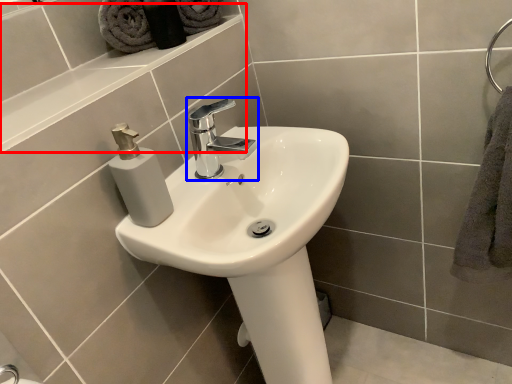
Question: Which object appears farthest to the camera in this image, ledge (highlighted by a red box) or tap (highlighted by a blue box)?

Choices:
 (A) ledge
 (B) tap

Answer: (B)